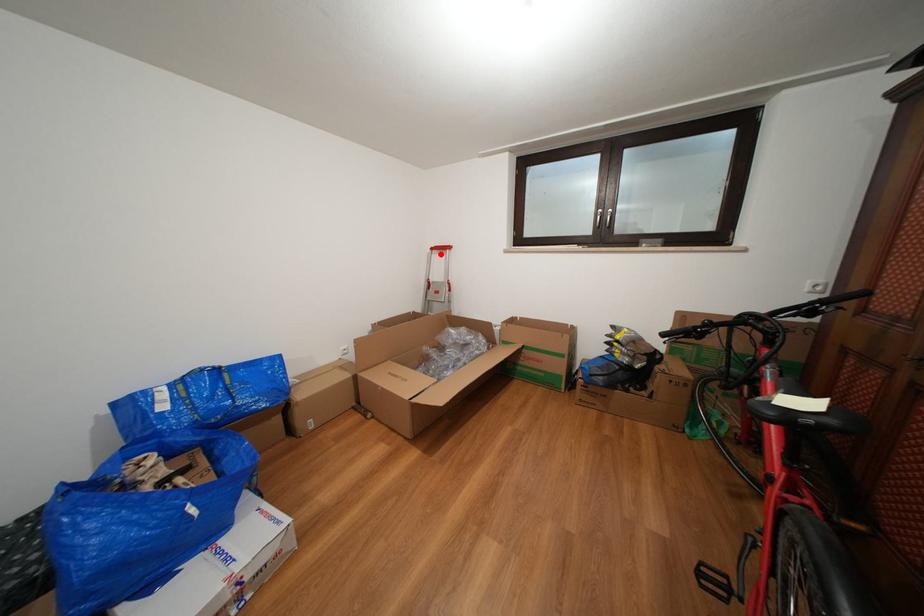
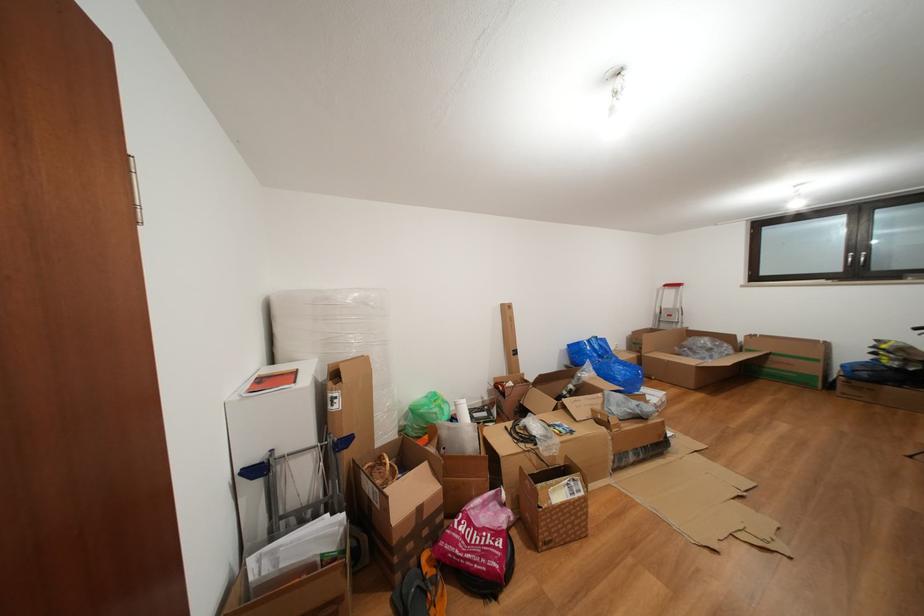
Find the pixel in the second image that matches the highlighted location in the first image.

(674, 291)